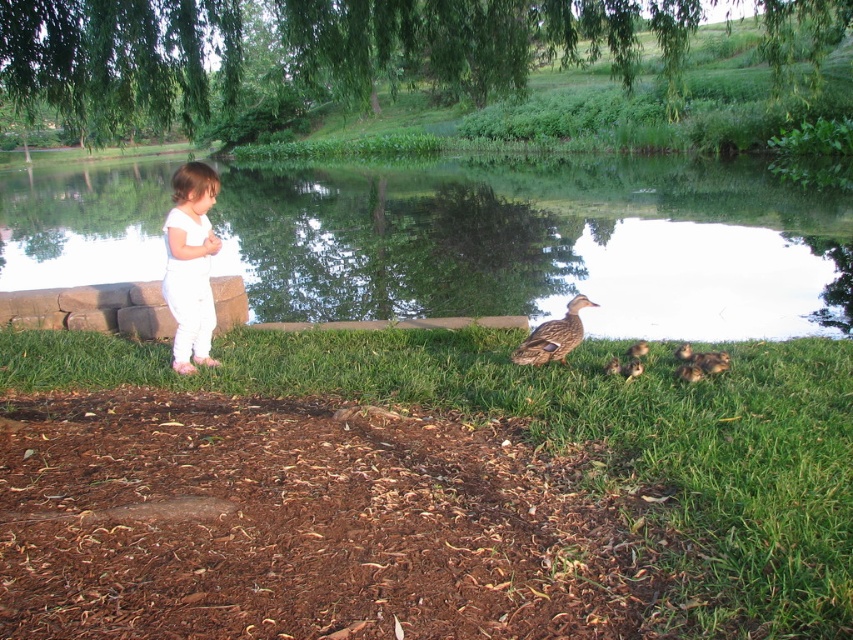
You are planning to place a small wooden boat in the scene. The boat requires a water area wider than the green leafy willow at upper center to float. Can the green reflective water at center accommodate the boat?

The green reflective water at center has a width less than the green leafy willow at upper center, so it cannot accommodate the boat which requires a water area wider than the green leafy willow at upper center.

From the picture: You are a photographer trying to capture the green leafy willow at upper center and the brown fuzzy duckling at lower center in the same frame. Which object should you focus on first if you want to ensure both are in focus without adjusting your camera settings?

The green leafy willow at upper center is bigger than the brown fuzzy duckling at lower center, so focusing on the green leafy willow at upper center first would help maintain focus on both objects as it is larger and likely farther away, requiring a smaller aperture or greater depth of field to include the closer, smaller duckling in focus.

You are a photographer trying to capture a photo of the brown fuzzy ducklings at lower right and the white cotton onesie at left. From which side should you position yourself to ensure both subjects are visible in the frame?

You should position yourself to the right side of the brown fuzzy ducklings at lower right so that the white cotton onesie at left is on the left side of the frame and the ducklings are on the right side, ensuring both are visible.